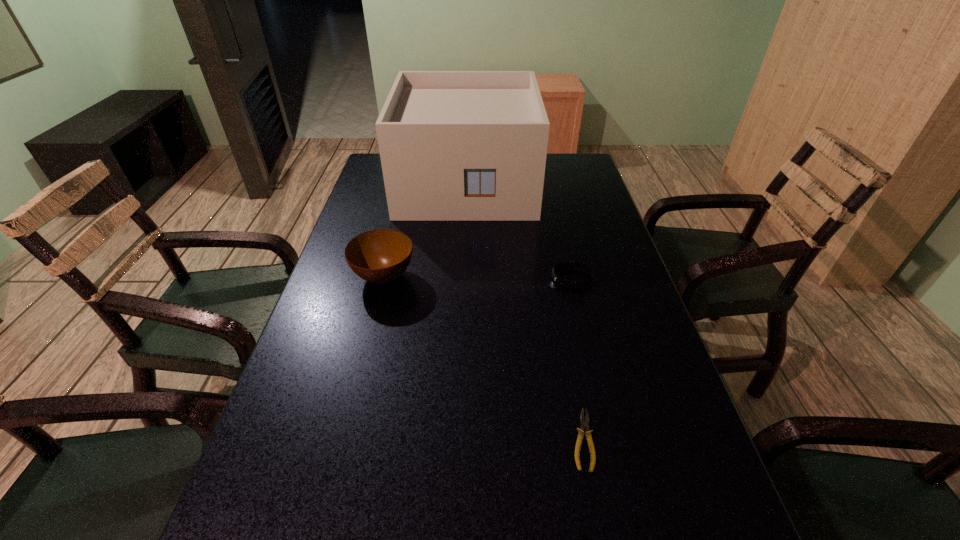
Where is `box`? box is located at coordinates (454, 145).

Image resolution: width=960 pixels, height=540 pixels. Find the location of `the farthest object`. the farthest object is located at coordinates (454, 145).

Find the location of a particular element. The image size is (960, 540). bowl is located at coordinates (380, 256).

Identify the location of wristband. (562, 282).

Locate an element on the screen. the shortest object is located at coordinates (584, 421).

Identify the location of pliers. This screenshot has height=540, width=960. coord(584,421).

Identify the location of free region located 0.320m on the side of the farthest object with the window. This screenshot has height=540, width=960. (462, 294).

Where is `vacant area situated on the right of the bowl`? This screenshot has width=960, height=540. vacant area situated on the right of the bowl is located at coordinates 498,276.

At what (x,y) coordinates should I click in order to perform the action: click on vacant space located 0.350m on the display of the third tallest object. Please return your answer as a coordinate pair (x, y). This screenshot has width=960, height=540. Looking at the image, I should click on (414, 278).

Image resolution: width=960 pixels, height=540 pixels. Identify the location of free space located on the display of the third tallest object. (441, 278).